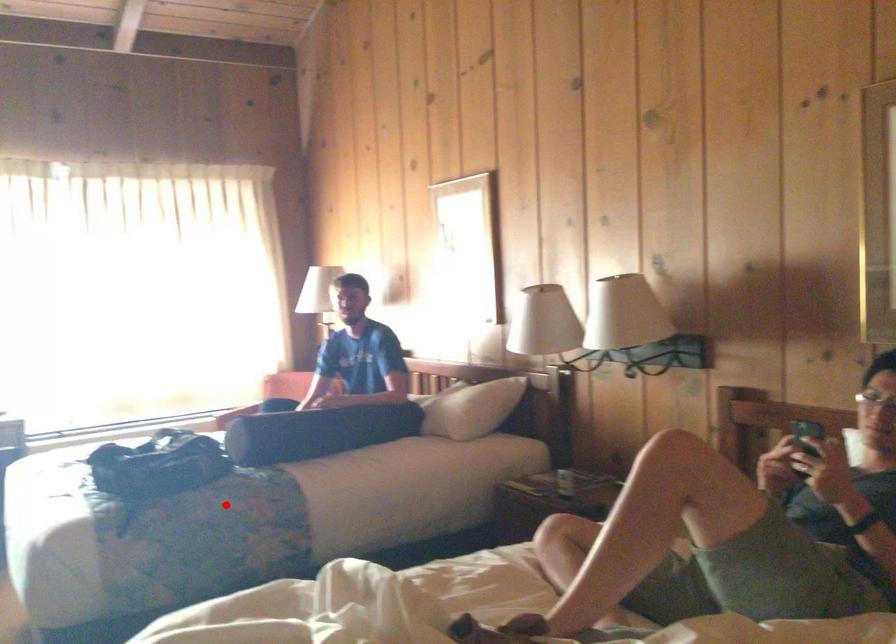
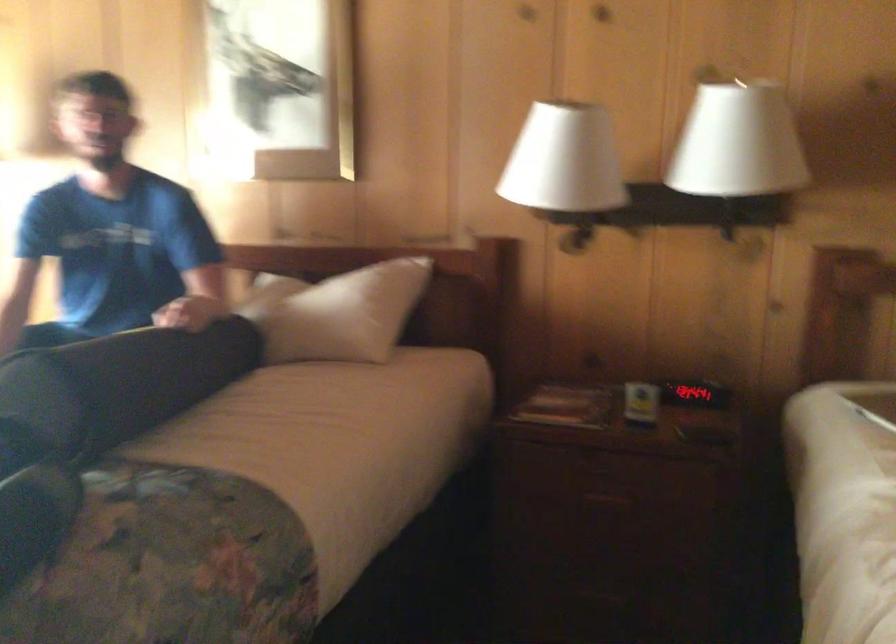
Question: I am providing you with two images of the same scene from different viewpoints. Given a red point in image1, look at the same physical point in image2. Is it:

Choices:
 (A) Closer to the viewpoint
 (B) Farther from the viewpoint

Answer: (A)